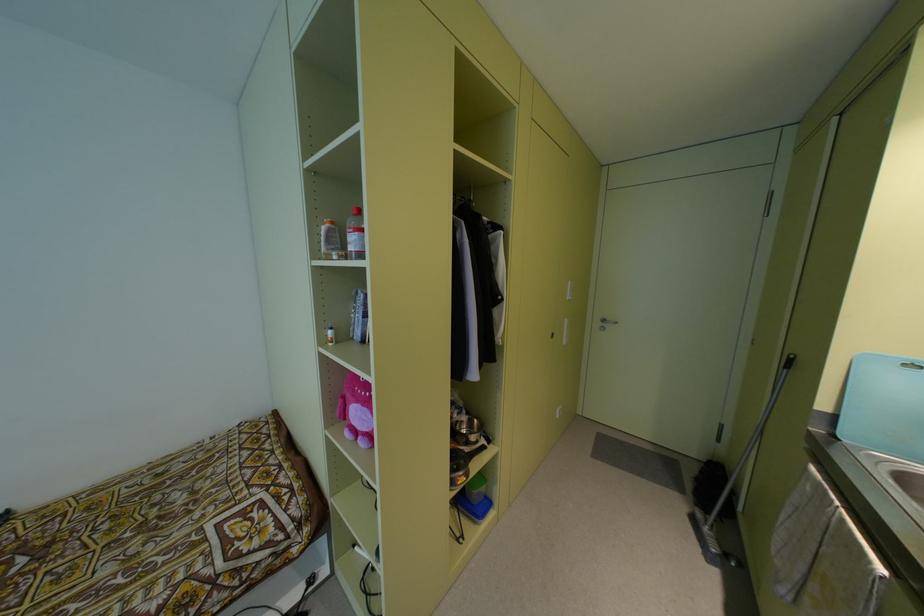
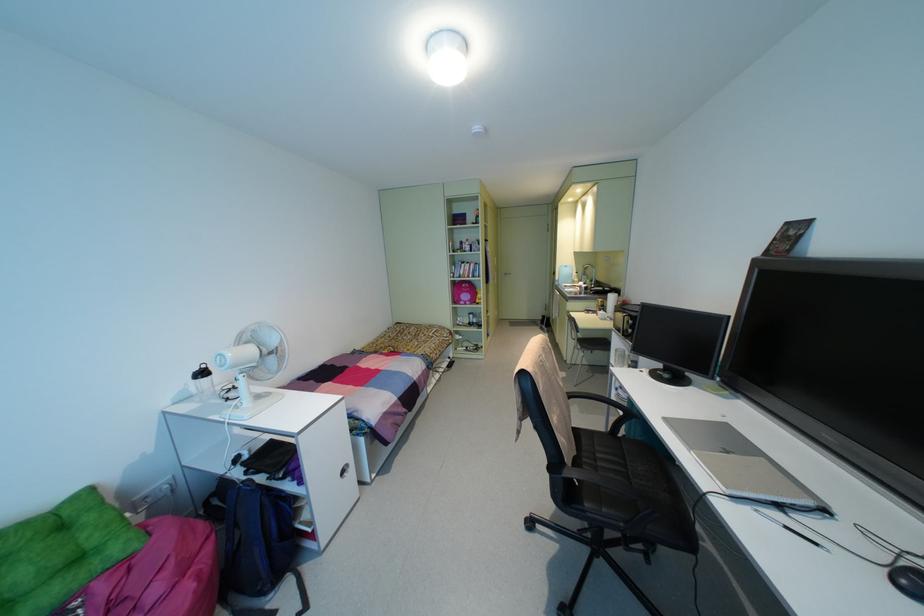
What movement of the cameraman would produce the second image?

The movement direction of the cameraman is left, backward.